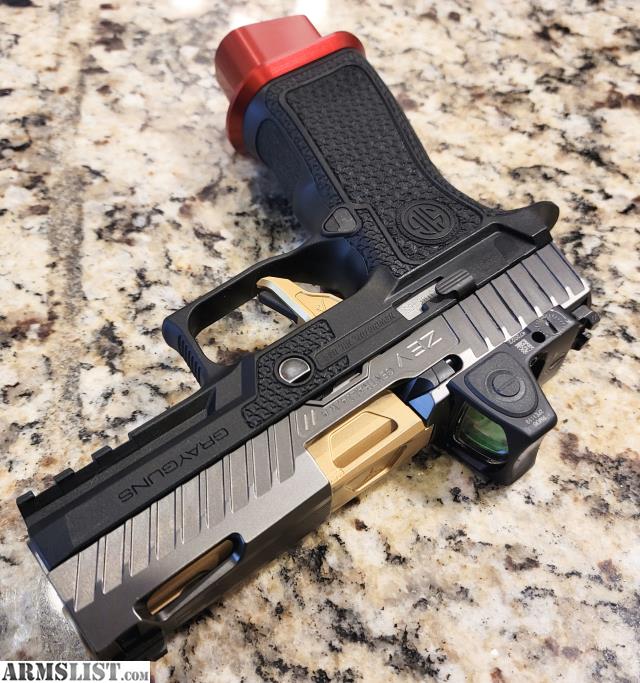
I want to click on granite countertop, so click(107, 188).